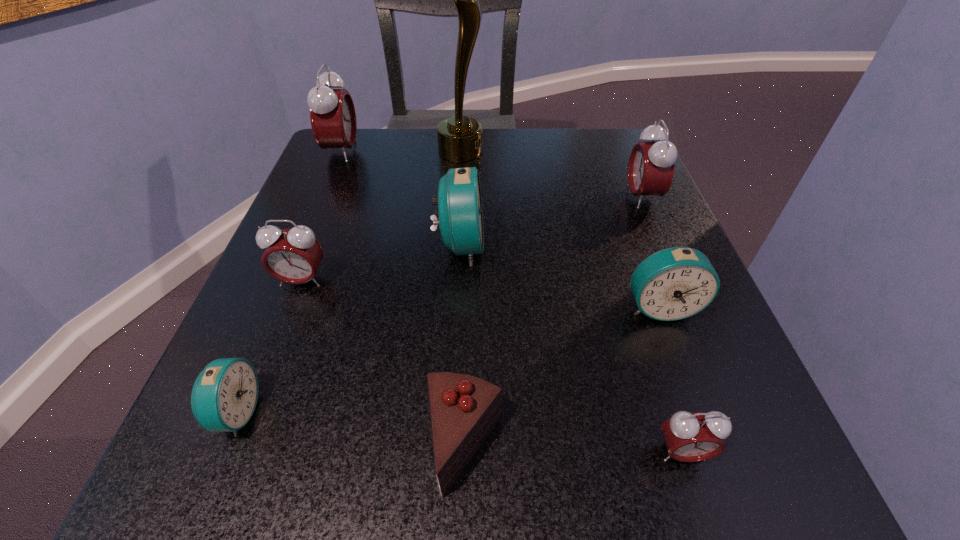
Find the location of a particular element. This screenshot has height=540, width=960. award is located at coordinates (460, 138).

Where is `the tallest alarm clock`? The width and height of the screenshot is (960, 540). the tallest alarm clock is located at coordinates (332, 113).

Where is `the farthest alarm clock`? the farthest alarm clock is located at coordinates (332, 113).

In order to click on the fourth alarm clock from left to right in this screenshot , I will do `click(460, 203)`.

Identify the location of the second blue alarm clock from right to left. (460, 203).

At what (x,y) coordinates should I click in order to perform the action: click on the third nearest pink alarm clock. Please return your answer as a coordinate pair (x, y). Image resolution: width=960 pixels, height=540 pixels. Looking at the image, I should click on (651, 165).

Locate an element on the screen. The image size is (960, 540). the rightmost pink alarm clock is located at coordinates (651, 165).

The height and width of the screenshot is (540, 960). I want to click on the third biggest pink alarm clock, so click(x=293, y=256).

Identify the location of the second biggest blue alarm clock. This screenshot has width=960, height=540. (675, 283).

The width and height of the screenshot is (960, 540). I want to click on the rightmost blue alarm clock, so click(x=675, y=283).